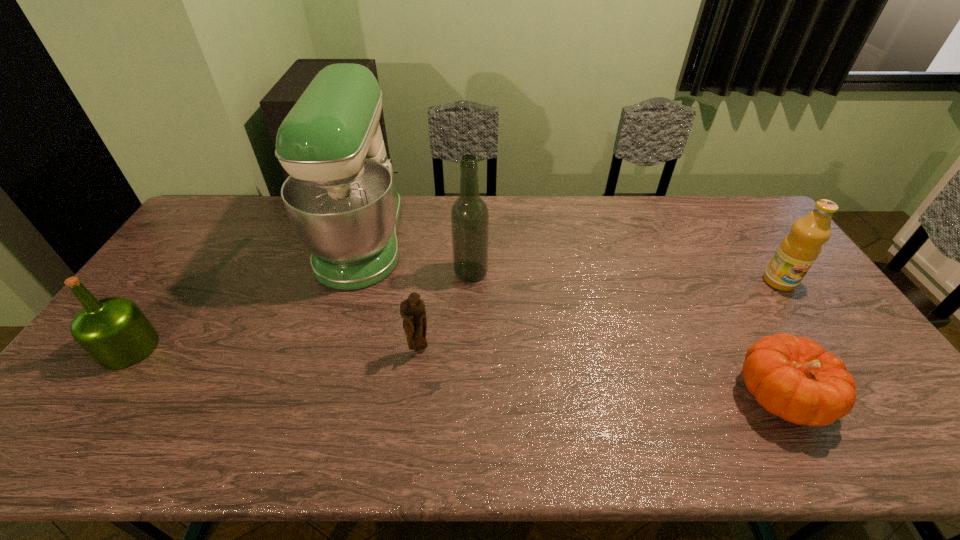
Where is `the second object from right to left`? This screenshot has width=960, height=540. the second object from right to left is located at coordinates (794, 378).

Find the location of `vacant space located on the controls of the tallest object`. vacant space located on the controls of the tallest object is located at coordinates click(443, 240).

Where is `free spot located 0.210m on the right of the liquor`? free spot located 0.210m on the right of the liquor is located at coordinates (555, 272).

This screenshot has width=960, height=540. In order to click on blank space located on the label of the right olive oil in this screenshot , I will do `click(801, 313)`.

Where is `blank space located on the right of the left olive oil`? This screenshot has width=960, height=540. blank space located on the right of the left olive oil is located at coordinates (269, 348).

Find the location of `blank space located on the front-facing side of the figurine`. blank space located on the front-facing side of the figurine is located at coordinates (416, 378).

At what (x,y) coordinates should I click in order to perform the action: click on vacant space located 0.240m on the back of the shortest object. Please return your answer as a coordinate pair (x, y). Image resolution: width=960 pixels, height=540 pixels. Looking at the image, I should click on (724, 293).

Identify the location of object situated at the far edge. Image resolution: width=960 pixels, height=540 pixels. (340, 196).

Where is `object situated at the near edge`? This screenshot has width=960, height=540. object situated at the near edge is located at coordinates (794, 378).

Locate an element on the screen. object at the left edge is located at coordinates (114, 331).